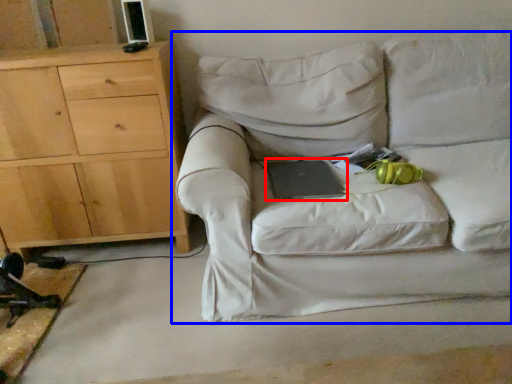
Question: Which object appears farthest to the camera in this image, paperback book (highlighted by a red box) or studio couch (highlighted by a blue box)?

Choices:
 (A) paperback book
 (B) studio couch

Answer: (A)